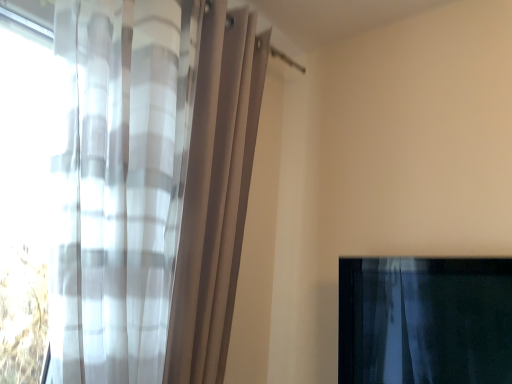
What do you see at coordinates (151, 186) in the screenshot?
I see `sheer white curtain at left, acting as the 2th curtain starting from the right` at bounding box center [151, 186].

Find the location of a particular element. Image resolution: width=512 pixels, height=384 pixels. sheer white curtain at left, acting as the 2th curtain starting from the right is located at coordinates (151, 186).

Measure the distance between point (378, 326) and camera.

The distance of point (378, 326) from camera is 5.09 feet.

Where is `translucent fabric curtain at lower right, positioned as the first curtain in right-to-left order`? The height and width of the screenshot is (384, 512). translucent fabric curtain at lower right, positioned as the first curtain in right-to-left order is located at coordinates (425, 320).

What do you see at coordinates (425, 320) in the screenshot?
I see `translucent fabric curtain at lower right, positioned as the first curtain in right-to-left order` at bounding box center [425, 320].

The image size is (512, 384). I want to click on sheer white curtain at left, acting as the 2th curtain starting from the right, so pos(151,186).

Looking at this image, does sheer white curtain at left, arranged as the first curtain when viewed from the left, appear on the right side of translucent fabric curtain at lower right, positioned as the first curtain in right-to-left order?

Incorrect, sheer white curtain at left, arranged as the first curtain when viewed from the left, is not on the right side of translucent fabric curtain at lower right, positioned as the first curtain in right-to-left order.

Which object is more forward, sheer white curtain at left, acting as the 2th curtain starting from the right, or translucent fabric curtain at lower right, arranged as the second curtain when viewed from the left?

sheer white curtain at left, acting as the 2th curtain starting from the right.

Is point (156, 53) closer or farther from the camera than point (382, 363)?

Point (156, 53) is positioned closer to the camera compared to point (382, 363).

From the image's perspective, which object appears higher, sheer white curtain at left, acting as the 2th curtain starting from the right, or translucent fabric curtain at lower right, positioned as the first curtain in right-to-left order?

sheer white curtain at left, acting as the 2th curtain starting from the right, from the image's perspective.

From a real-world perspective, which object rests below the other?

translucent fabric curtain at lower right, arranged as the second curtain when viewed from the left, from a real-world perspective.

Which of these two, sheer white curtain at left, arranged as the first curtain when viewed from the left, or translucent fabric curtain at lower right, arranged as the second curtain when viewed from the left, is wider?

Wider between the two is sheer white curtain at left, arranged as the first curtain when viewed from the left.

Considering the sizes of objects sheer white curtain at left, arranged as the first curtain when viewed from the left, and translucent fabric curtain at lower right, positioned as the first curtain in right-to-left order, in the image provided, who is taller, sheer white curtain at left, arranged as the first curtain when viewed from the left, or translucent fabric curtain at lower right, positioned as the first curtain in right-to-left order,?

sheer white curtain at left, arranged as the first curtain when viewed from the left.

Between sheer white curtain at left, acting as the 2th curtain starting from the right, and translucent fabric curtain at lower right, arranged as the second curtain when viewed from the left, which one has larger size?

Bigger between the two is sheer white curtain at left, acting as the 2th curtain starting from the right.

Is sheer white curtain at left, arranged as the first curtain when viewed from the left, not inside translucent fabric curtain at lower right, positioned as the first curtain in right-to-left order?

Absolutely, sheer white curtain at left, arranged as the first curtain when viewed from the left, is external to translucent fabric curtain at lower right, positioned as the first curtain in right-to-left order.

Is sheer white curtain at left, acting as the 2th curtain starting from the right, not close to translucent fabric curtain at lower right, positioned as the first curtain in right-to-left order?

sheer white curtain at left, acting as the 2th curtain starting from the right, is actually quite close to translucent fabric curtain at lower right, positioned as the first curtain in right-to-left order.

Is translucent fabric curtain at lower right, arranged as the second curtain when viewed from the left, at the back of sheer white curtain at left, arranged as the first curtain when viewed from the left?

No, sheer white curtain at left, arranged as the first curtain when viewed from the left, is not facing the opposite direction of translucent fabric curtain at lower right, arranged as the second curtain when viewed from the left.

In order to click on curtain below the sheer white curtain at left, acting as the 2th curtain starting from the right (from a real-world perspective) in this screenshot , I will do `click(425, 320)`.

Is translucent fabric curtain at lower right, arranged as the second curtain when viewed from the left, to the left of sheer white curtain at left, arranged as the first curtain when viewed from the left, from the viewer's perspective?

Incorrect, translucent fabric curtain at lower right, arranged as the second curtain when viewed from the left, is not on the left side of sheer white curtain at left, arranged as the first curtain when viewed from the left.

Is translucent fabric curtain at lower right, arranged as the second curtain when viewed from the left, further to camera compared to sheer white curtain at left, arranged as the first curtain when viewed from the left?

Yes, it is.

Between point (358, 340) and point (143, 112), which one is positioned in front?

Positioned in front is point (143, 112).

Consider the image. From the image's perspective, is translucent fabric curtain at lower right, arranged as the second curtain when viewed from the left, below sheer white curtain at left, acting as the 2th curtain starting from the right?

Correct, translucent fabric curtain at lower right, arranged as the second curtain when viewed from the left, appears lower than sheer white curtain at left, acting as the 2th curtain starting from the right, in the image.

From a real-world perspective, is translucent fabric curtain at lower right, arranged as the second curtain when viewed from the left, positioned over sheer white curtain at left, acting as the 2th curtain starting from the right, based on gravity?

No, from a real-world perspective, translucent fabric curtain at lower right, arranged as the second curtain when viewed from the left, is not over sheer white curtain at left, acting as the 2th curtain starting from the right

Considering the sizes of objects translucent fabric curtain at lower right, positioned as the first curtain in right-to-left order, and sheer white curtain at left, arranged as the first curtain when viewed from the left, in the image provided, who is wider, translucent fabric curtain at lower right, positioned as the first curtain in right-to-left order, or sheer white curtain at left, arranged as the first curtain when viewed from the left,?

sheer white curtain at left, arranged as the first curtain when viewed from the left.

Who is taller, translucent fabric curtain at lower right, positioned as the first curtain in right-to-left order, or sheer white curtain at left, acting as the 2th curtain starting from the right?

sheer white curtain at left, acting as the 2th curtain starting from the right.

Considering the relative sizes of translucent fabric curtain at lower right, positioned as the first curtain in right-to-left order, and sheer white curtain at left, acting as the 2th curtain starting from the right, in the image provided, is translucent fabric curtain at lower right, positioned as the first curtain in right-to-left order, bigger than sheer white curtain at left, acting as the 2th curtain starting from the right,?

No.

Is sheer white curtain at left, acting as the 2th curtain starting from the right, inside translucent fabric curtain at lower right, positioned as the first curtain in right-to-left order?

Actually, sheer white curtain at left, acting as the 2th curtain starting from the right, is outside translucent fabric curtain at lower right, positioned as the first curtain in right-to-left order.

Is translucent fabric curtain at lower right, positioned as the first curtain in right-to-left order, far from sheer white curtain at left, acting as the 2th curtain starting from the right?

No, translucent fabric curtain at lower right, positioned as the first curtain in right-to-left order, is not far from sheer white curtain at left, acting as the 2th curtain starting from the right.

Is translucent fabric curtain at lower right, positioned as the first curtain in right-to-left order, looking in the opposite direction of sheer white curtain at left, arranged as the first curtain when viewed from the left?

No, translucent fabric curtain at lower right, positioned as the first curtain in right-to-left order,'s orientation is not away from sheer white curtain at left, arranged as the first curtain when viewed from the left.

What's the angular difference between translucent fabric curtain at lower right, positioned as the first curtain in right-to-left order, and sheer white curtain at left, acting as the 2th curtain starting from the right,'s facing directions?

translucent fabric curtain at lower right, positioned as the first curtain in right-to-left order, and sheer white curtain at left, acting as the 2th curtain starting from the right, are facing 90 degrees away from each other.

The height and width of the screenshot is (384, 512). Identify the location of curtain behind the sheer white curtain at left, arranged as the first curtain when viewed from the left. (425, 320).

You are a GUI agent. You are given a task and a screenshot of the screen. Output one action in this format:
    pyautogui.click(x=<x>, y=<y>)
    Task: Click on the curtain below the sheer white curtain at left, arranged as the first curtain when viewed from the left (from a real-world perspective)
    This screenshot has height=384, width=512.
    Given the screenshot: What is the action you would take?
    pyautogui.click(x=425, y=320)

The width and height of the screenshot is (512, 384). In order to click on curtain that appears above the translucent fabric curtain at lower right, arranged as the second curtain when viewed from the left (from the image's perspective) in this screenshot , I will do `click(151, 186)`.